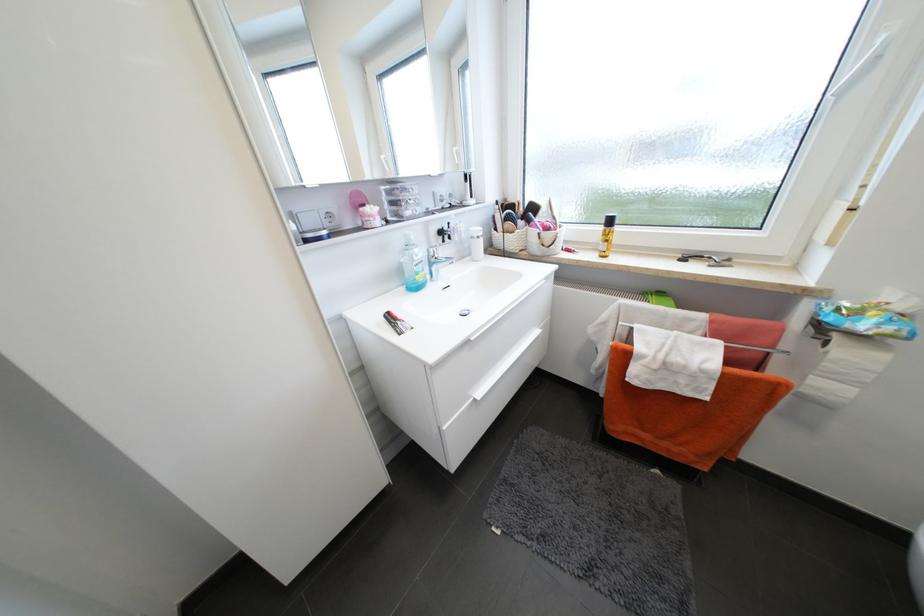
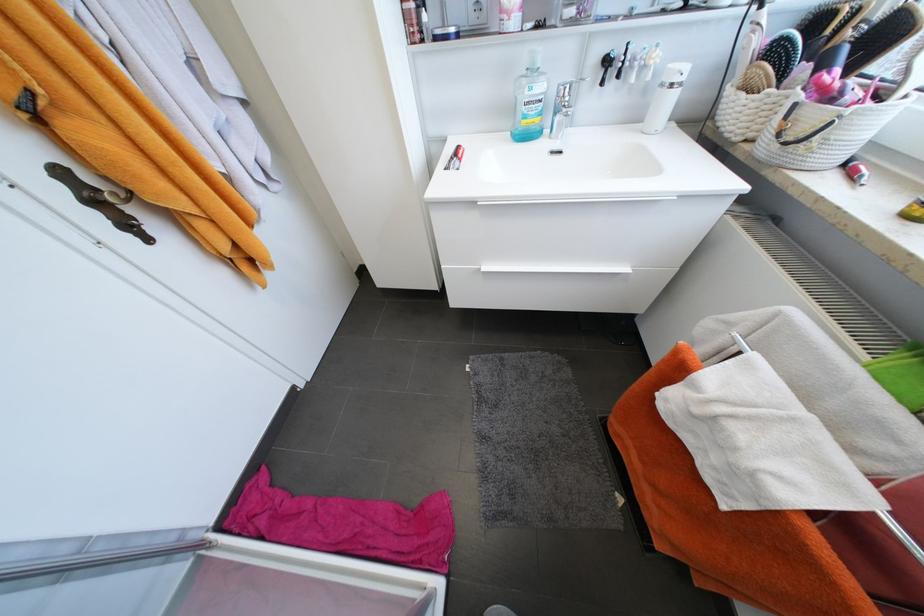
In the second image, find the point that corresponds to point 436,265 in the first image.

(562, 113)